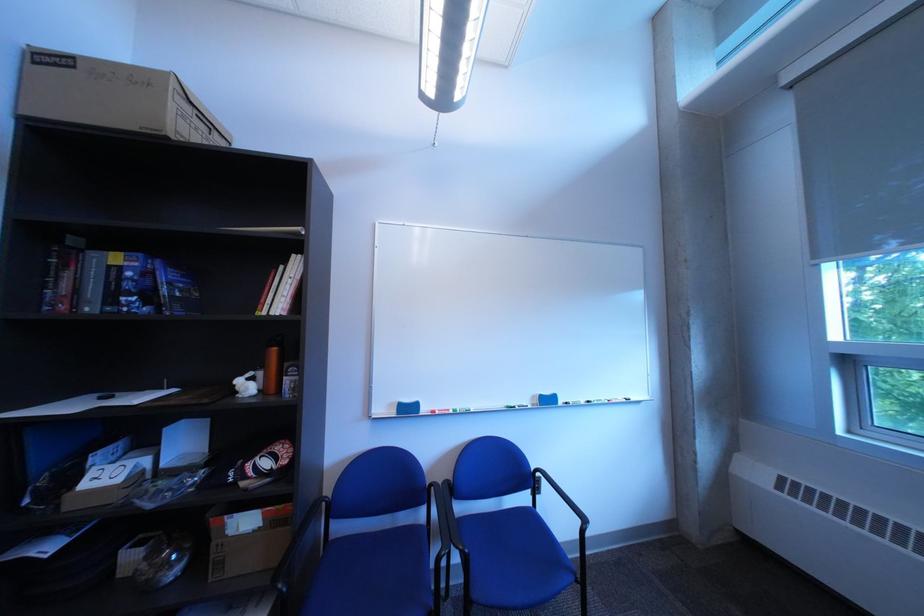
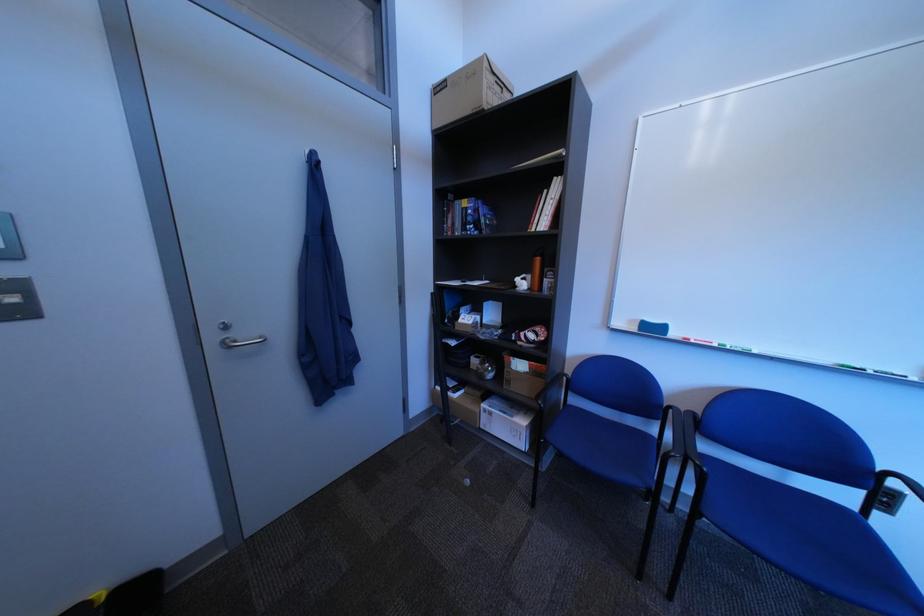
Where in the second image is the point corresponding to (257,378) from the first image?

(535, 278)